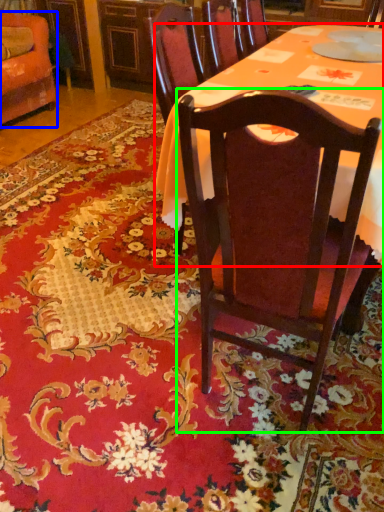
Question: Considering the real-world distances, which object is closest to desk (highlighted by a red box)? chair (highlighted by a blue box) or chair (highlighted by a green box).

Choices:
 (A) chair
 (B) chair

Answer: (B)